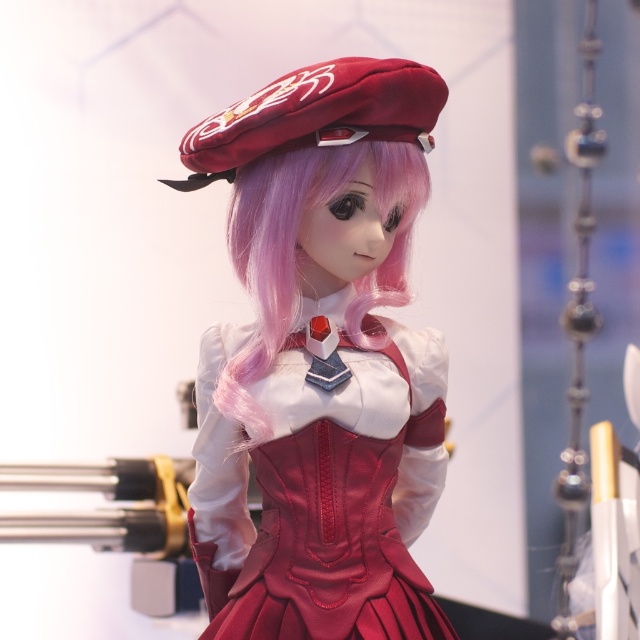
Question: Does matte velvet beret at center appear on the right side of pink silky hair at center?

Choices:
 (A) yes
 (B) no

Answer: (A)

Question: Which point appears farthest from the camera in this image?

Choices:
 (A) (296, 225)
 (B) (333, 580)

Answer: (A)

Question: Which of the following is the closest to the observer?

Choices:
 (A) (310, 90)
 (B) (244, 177)

Answer: (A)

Question: Estimate the real-world distances between objects in this image. Which object is farther from the satin red beret at upper center?

Choices:
 (A) pink silky hair at center
 (B) matte velvet beret at center

Answer: (B)

Question: Is matte velvet beret at center smaller than pink silky hair at center?

Choices:
 (A) no
 (B) yes

Answer: (A)

Question: Is matte velvet beret at center above pink silky hair at center?

Choices:
 (A) no
 (B) yes

Answer: (A)